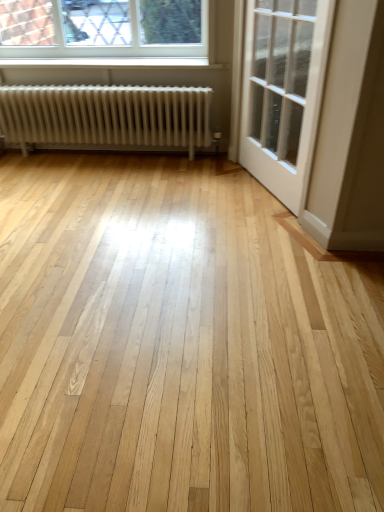
Locate an element on the screen. free space in front of white matte radiator at left is located at coordinates point(115,218).